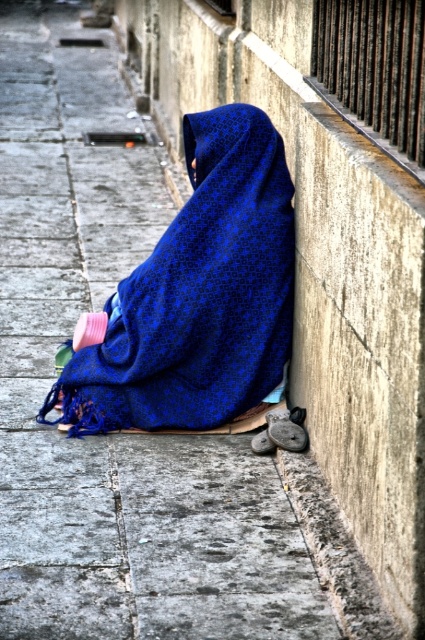
Question: Among these points, which one is farthest from the camera?

Choices:
 (A) (348, 538)
 (B) (107, 397)

Answer: (B)

Question: Where is blue woven blanket at lower center located in relation to gray concrete curb at lower right in the image?

Choices:
 (A) above
 (B) below

Answer: (A)

Question: Is blue woven blanket at lower center positioned at the back of gray concrete curb at lower right?

Choices:
 (A) yes
 (B) no

Answer: (A)

Question: Among these objects, which one is nearest to the camera?

Choices:
 (A) blue woven blanket at lower center
 (B) gray concrete curb at lower right

Answer: (B)

Question: Does blue woven blanket at lower center have a smaller size compared to gray concrete curb at lower right?

Choices:
 (A) yes
 (B) no

Answer: (B)